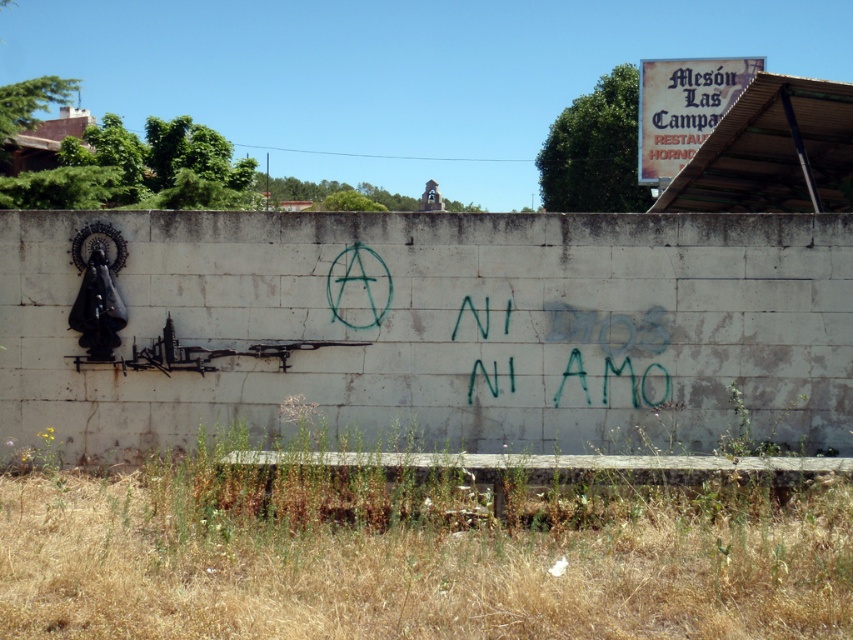
Is white concrete wall at center to the left of green paint at center from the viewer's perspective?

No, white concrete wall at center is not to the left of green paint at center.

Is point (714, 408) farther from viewer compared to point (646, 346)?

No, (714, 408) is closer to viewer.

Is point (229, 371) in front of point (560, 308)?

That is False.

The image size is (853, 640). Identify the location of white concrete wall at center. (437, 330).